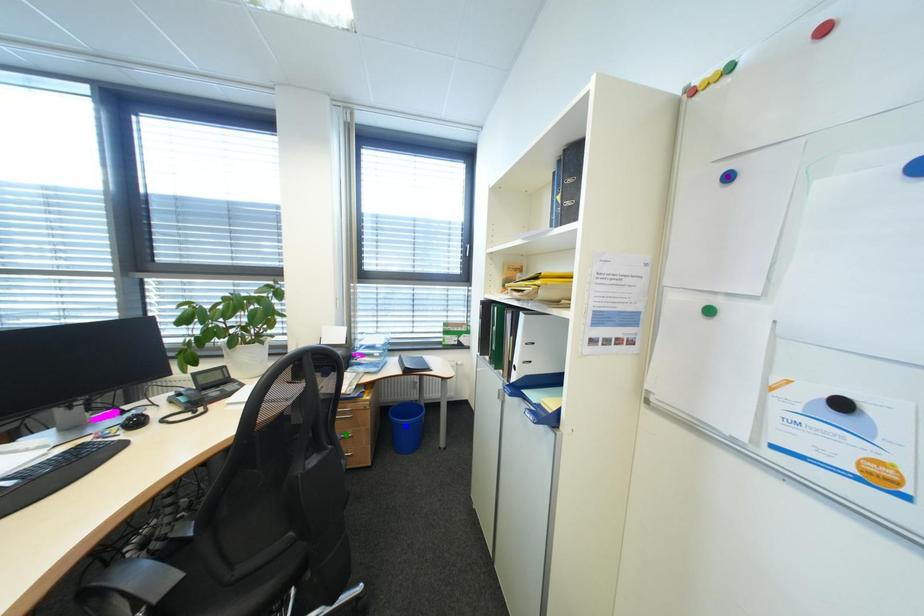
Order these from nearest to farthest:
- green point
- blue point
- purple point

purple point < green point < blue point